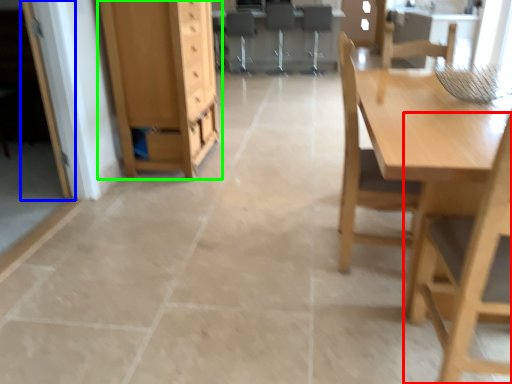
Question: Which object is positioned farthest from chair (highlighted by a red box)? Select from glass door (highlighted by a blue box) and cabinetry (highlighted by a green box).

Choices:
 (A) glass door
 (B) cabinetry

Answer: (A)